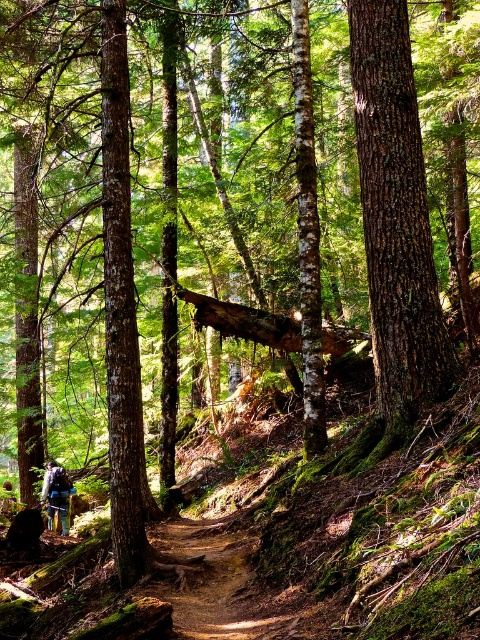
Does brown dirt trail at center have a smaller size compared to blue fabric backpack at lower left?

Yes.

Is point (288, 632) less distant than point (59, 472)?

Yes, it is.

The width and height of the screenshot is (480, 640). What are the coordinates of `brown dirt trail at center` in the screenshot? It's located at (213, 580).

Does brown rough bark tree at center appear on the right side of blue fabric backpack at lower left?

Indeed, brown rough bark tree at center is positioned on the right side of blue fabric backpack at lower left.

Can you confirm if brown rough bark tree at center is shorter than blue fabric backpack at lower left?

No, brown rough bark tree at center is not shorter than blue fabric backpack at lower left.

Which is in front, point (402, 340) or point (59, 470)?

Point (402, 340) is in front.

Where is `brown rough bark tree at center`? brown rough bark tree at center is located at coordinates (396, 225).

Does brown rough bark tree at center appear over brown dirt trail at center?

Yes.

Does brown rough bark tree at center come behind brown dirt trail at center?

No, brown rough bark tree at center is in front of brown dirt trail at center.

The height and width of the screenshot is (640, 480). Identify the location of brown rough bark tree at center. (396, 225).